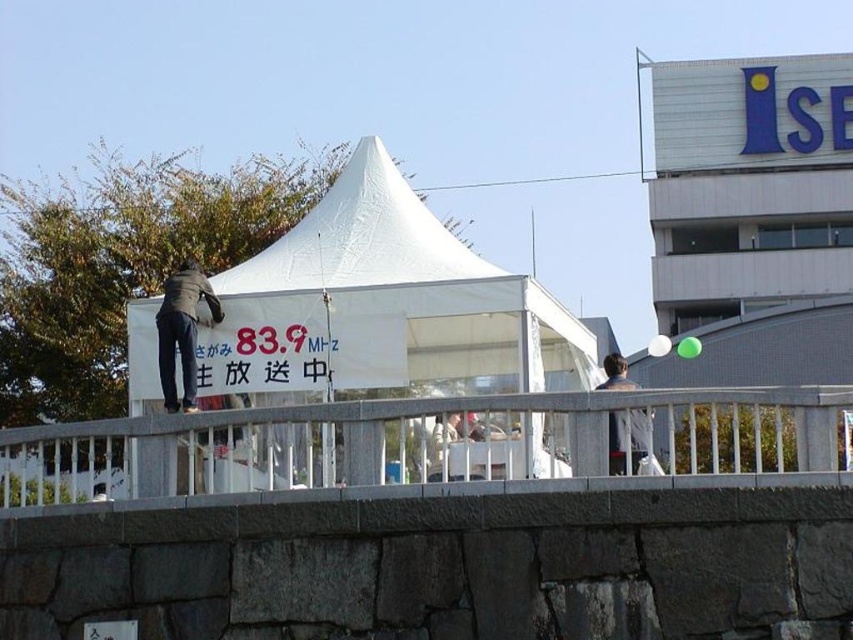
Question: Can you confirm if dark gray jacket at upper center is positioned below light brown leather jacket at center?

Choices:
 (A) yes
 (B) no

Answer: (B)

Question: Does white plastic railing at center appear under dark gray jacket at left?

Choices:
 (A) no
 (B) yes

Answer: (B)

Question: Can you confirm if dark gray jacket at upper center is positioned below light brown leather jacket at center?

Choices:
 (A) no
 (B) yes

Answer: (A)

Question: Which is farther from the white plastic railing at center?

Choices:
 (A) dark gray jacket at upper center
 (B) light brown leather jacket at center
 (C) white fabric tent at center
 (D) dark gray jacket at left

Answer: (D)

Question: Estimate the real-world distances between objects in this image. Which object is closer to the dark gray jacket at upper center?

Choices:
 (A) light brown leather jacket at center
 (B) white plastic railing at center
 (C) white fabric tent at center
 (D) dark gray jacket at left

Answer: (A)

Question: Which point is closer to the camera taking this photo?

Choices:
 (A) (132, 339)
 (B) (453, 426)
 (C) (607, 401)

Answer: (C)